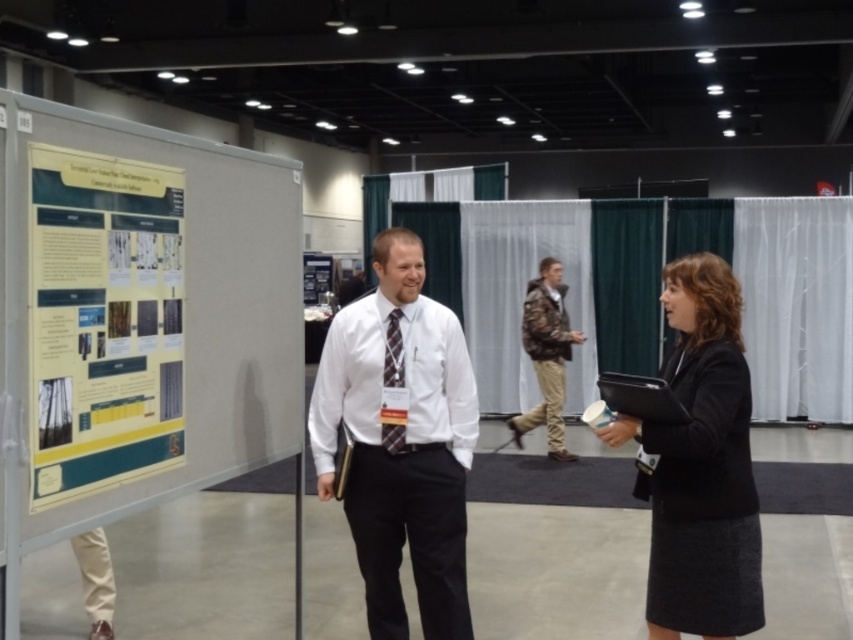
Question: Which object appears farthest from the camera in this image?

Choices:
 (A) plaid fabric tie at center
 (B) yellow paper poster at left
 (C) camouflage jacket at center
 (D) black wool skirt at right

Answer: (C)

Question: Where is black wool skirt at right located in relation to camouflage jacket at center in the image?

Choices:
 (A) above
 (B) below

Answer: (B)

Question: Can you confirm if white shirt at center is bigger than black wool skirt at right?

Choices:
 (A) no
 (B) yes

Answer: (B)

Question: Which of the following is the farthest from the observer?

Choices:
 (A) yellow paper poster at left
 (B) plaid fabric tie at center

Answer: (B)

Question: Is white shirt at center further to the viewer compared to black wool skirt at right?

Choices:
 (A) yes
 (B) no

Answer: (A)

Question: Which point appears farthest from the camera in this image?

Choices:
 (A) (82, 369)
 (B) (399, 310)
 (C) (431, 445)

Answer: (B)